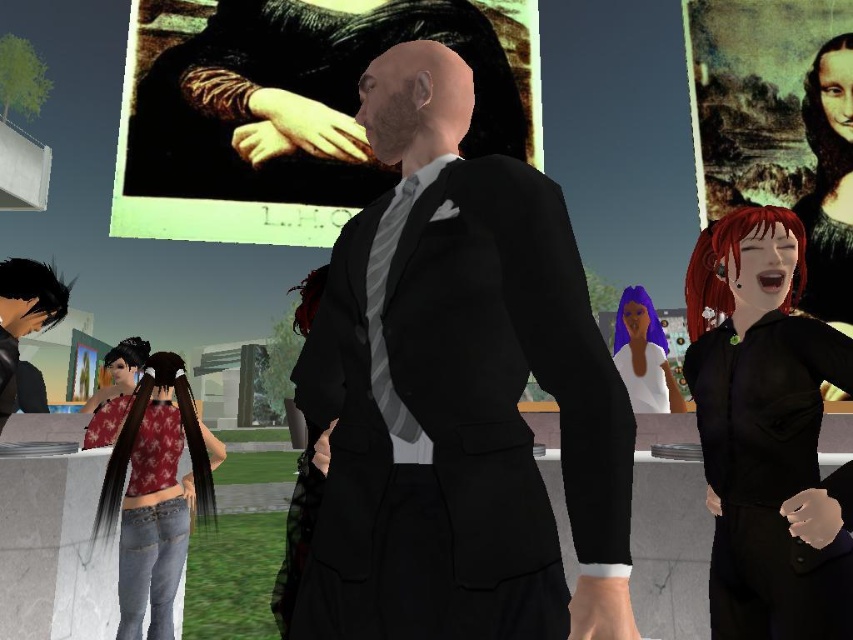
Based on the photo, between matte canvas painting at upper right and matte purple hair at center, which one is positioned higher?

matte canvas painting at upper right is higher up.

Which is in front, point (698, 154) or point (672, 385)?

Point (672, 385) is more forward.

Where is `matte canvas painting at upper right`? The image size is (853, 640). matte canvas painting at upper right is located at coordinates (753, 93).

Is shiny black hair at left smaller than matte red shirt at lower left?

Actually, shiny black hair at left might be larger than matte red shirt at lower left.

Which is behind, point (67, 301) or point (128, 342)?

Positioned behind is point (128, 342).

Between point (6, 317) and point (109, 397), which one is positioned behind?

Point (109, 397)

The height and width of the screenshot is (640, 853). In order to click on shiny black hair at left in this screenshot , I will do `click(24, 316)`.

What do you see at coordinates (764, 432) in the screenshot?
I see `shiny black shirt at right` at bounding box center [764, 432].

Can you confirm if shiny black shirt at right is smaller than denim jeans at lower left?

Indeed, shiny black shirt at right has a smaller size compared to denim jeans at lower left.

Measure the distance between shiny black shirt at right and camera.

They are 1.53 meters apart.

Find the location of a particular element. shiny black shirt at right is located at coordinates 764,432.